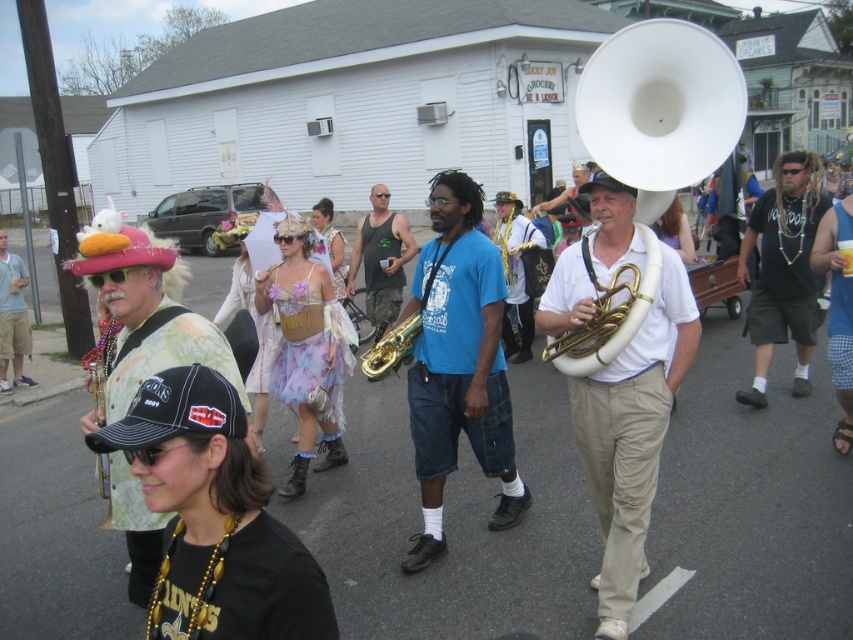
You are a photographer at the parade. You need to capture a photo where the white matte tuba at center and the gold brass trumpet at center are both visible. Which instrument should be placed on the right side of the photo to ensure both are in frame?

The white matte tuba at center should be placed on the right side of the photo because it is already positioned to the right of the gold brass trumpet at center in the scene.

You are standing at the starting point of the parade route and want to reach the end. There are two checkpoints marked by points on the image. The first checkpoint is at point (577, 250) and the second is at point (403, 323). Which checkpoint should you reach first according to their positions?

Point (577, 250) is in front of point (403, 323), so you should reach the first checkpoint at point (577, 250) before the second one at point (403, 323).